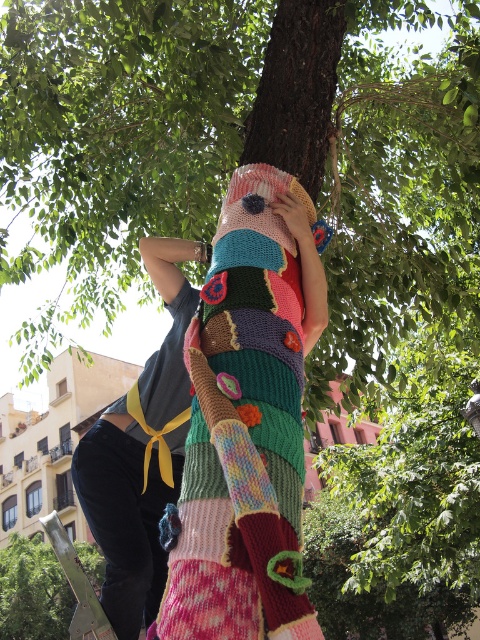
Question: Does knitted multicolored blanket at center have a lesser width compared to wooden post at lower left?

Choices:
 (A) no
 (B) yes

Answer: (B)

Question: Which point is farther from the camera taking this photo?

Choices:
 (A) (207, 307)
 (B) (72, 608)

Answer: (B)

Question: Does knitted multicolored blanket at center have a greater width compared to wooden post at lower left?

Choices:
 (A) no
 (B) yes

Answer: (A)

Question: Is the position of knitted multicolored blanket at center less distant than that of wooden post at lower left?

Choices:
 (A) no
 (B) yes

Answer: (B)